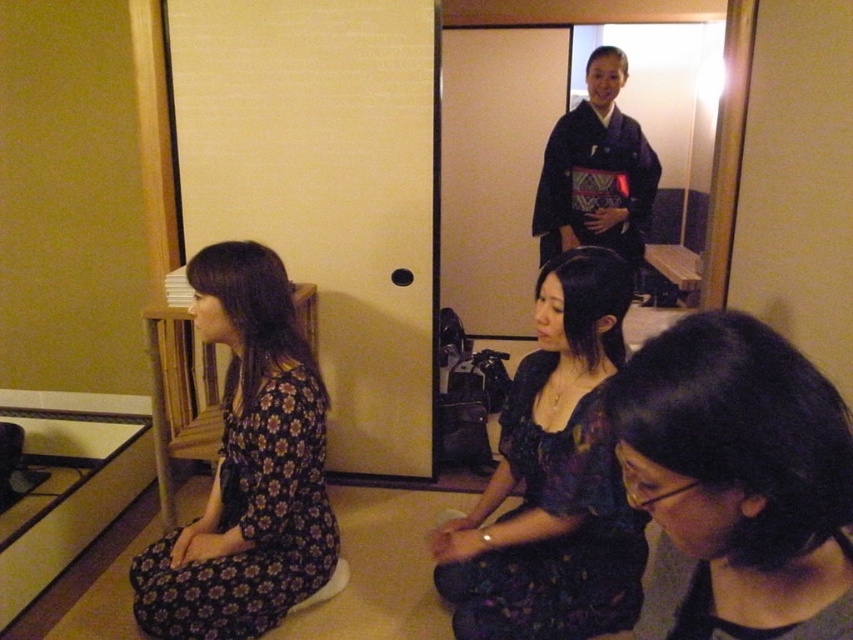
Question: Which point is closer to the camera taking this photo?

Choices:
 (A) (514, 609)
 (B) (592, 108)

Answer: (A)

Question: Estimate the real-world distances between objects in this image. Which object is closer to the floral-patterned dress at left?

Choices:
 (A) dark floral dress at center
 (B) dark gray matte/black hair at lower right
 (C) dark blue kimono at upper center

Answer: (A)

Question: Is dark gray matte/black hair at lower right above dark blue kimono at upper center?

Choices:
 (A) no
 (B) yes

Answer: (A)

Question: Can you confirm if dark gray matte/black hair at lower right is smaller than floral-patterned dress at left?

Choices:
 (A) no
 (B) yes

Answer: (B)

Question: Is dark gray matte/black hair at lower right to the right of dark floral dress at center from the viewer's perspective?

Choices:
 (A) yes
 (B) no

Answer: (A)

Question: Considering the real-world distances, which object is farthest from the dark gray matte/black hair at lower right?

Choices:
 (A) dark floral dress at center
 (B) floral-patterned dress at left

Answer: (B)